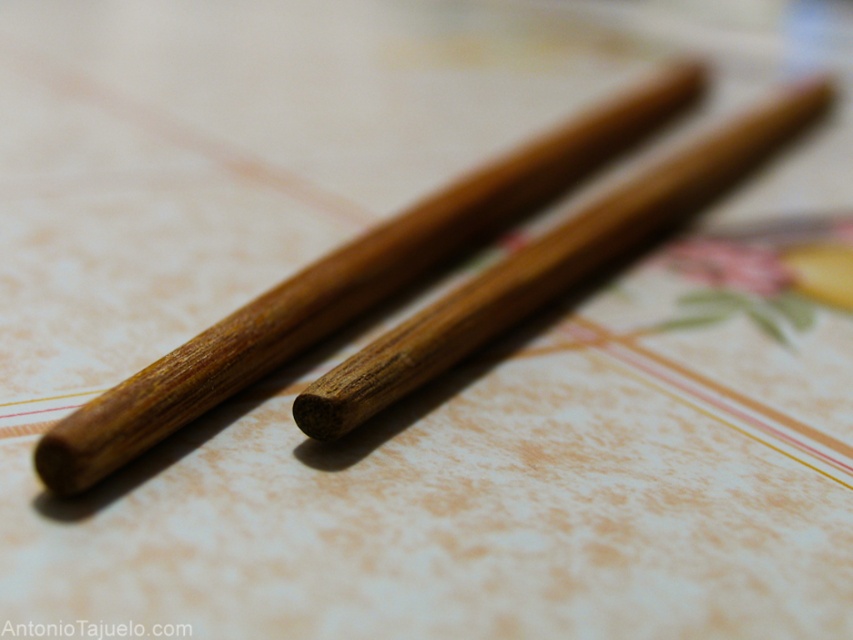
Question: Does wooden chopsticks at center lie in front of brown wood chopstick at center?

Choices:
 (A) yes
 (B) no

Answer: (A)

Question: Among these objects, which one is farthest from the camera?

Choices:
 (A) wooden chopsticks at center
 (B) brown wood chopstick at center

Answer: (B)

Question: Is wooden chopsticks at center bigger than brown wood chopstick at center?

Choices:
 (A) yes
 (B) no

Answer: (A)

Question: Which object is closer to the camera taking this photo?

Choices:
 (A) brown wood chopstick at center
 (B) wooden chopsticks at center

Answer: (B)

Question: Is wooden chopsticks at center thinner than brown wood chopstick at center?

Choices:
 (A) yes
 (B) no

Answer: (B)